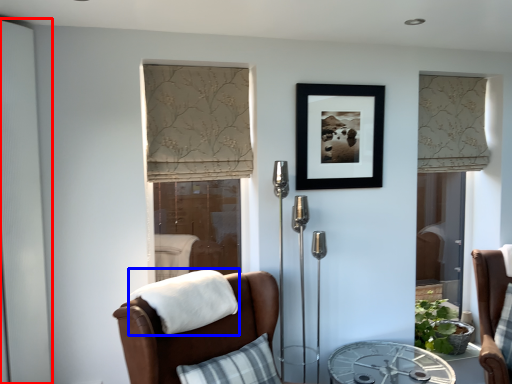
Question: Which of the following is the closest to the observer, screen door (highlighted by a red box) or blanket (highlighted by a blue box)?

Choices:
 (A) screen door
 (B) blanket

Answer: (B)